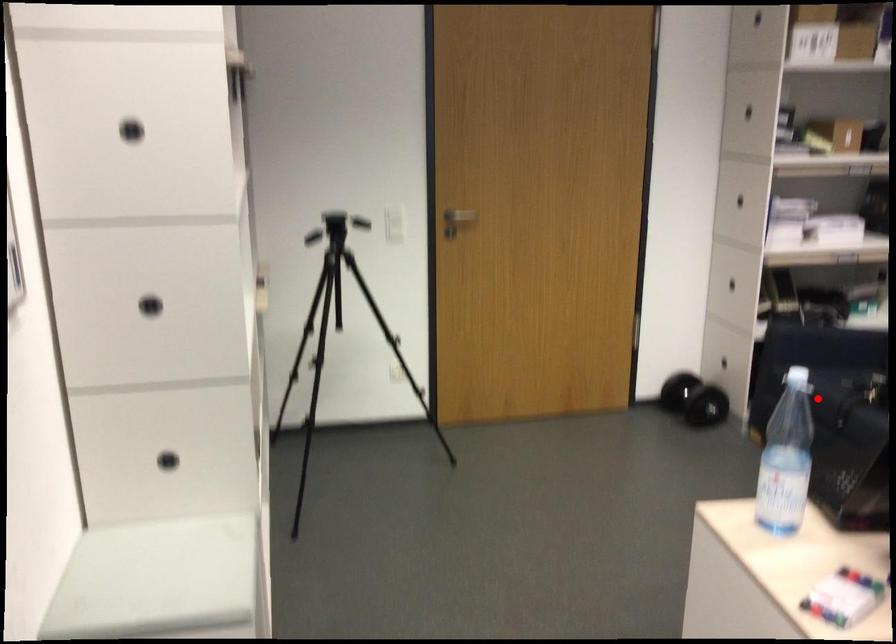
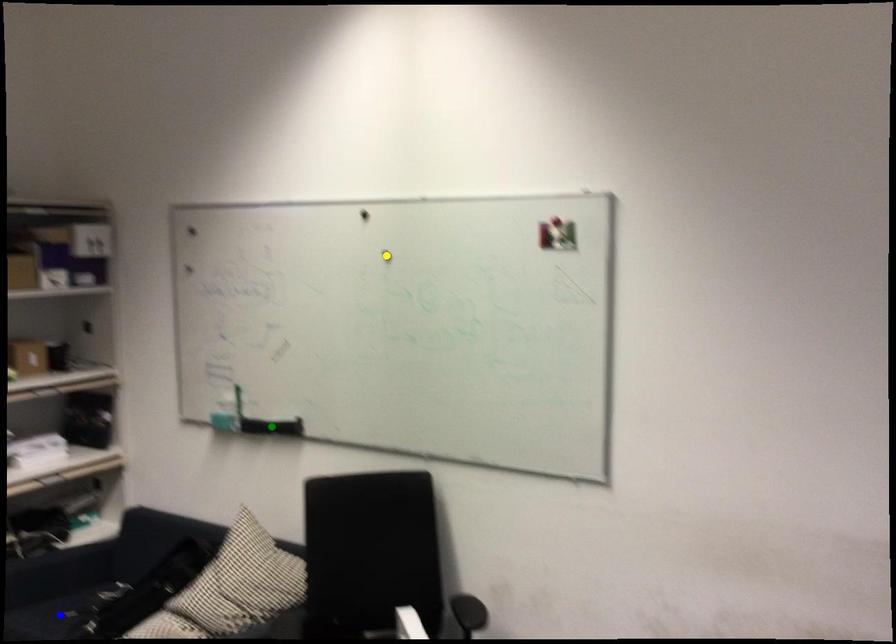
Question: I am providing you with two images of the same scene from different viewpoints. A red point is marked on the first image. You are given multiple points on the second image. Can you choose the point in image 2 that corresponds to the point in image 1?

Choices:
 (A) green point
 (B) yellow point
 (C) blue point

Answer: (C)